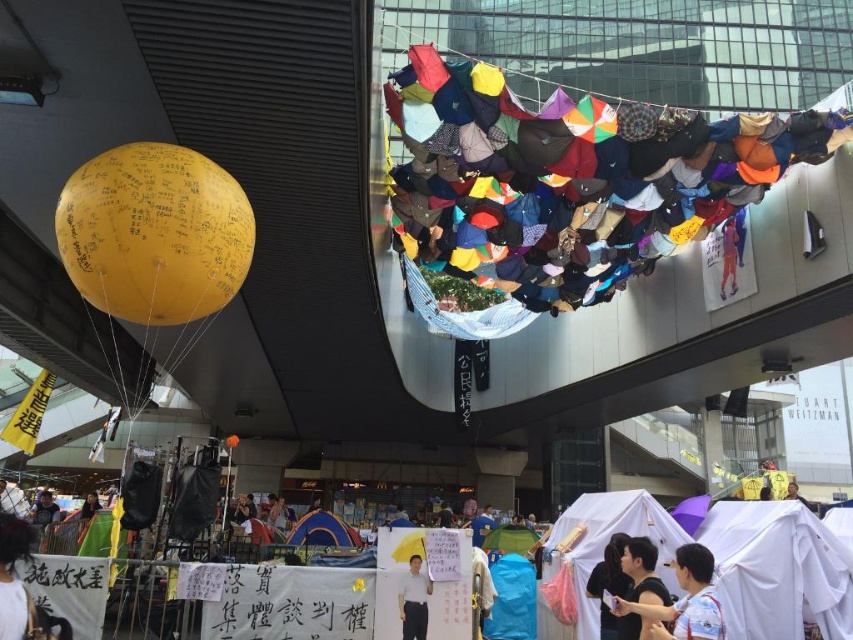
Who is more forward, (122, 266) or (96, 508)?

Point (122, 266) is more forward.

Does yellow matte balloon at left have a larger size compared to light brown fabric at lower left?

No, yellow matte balloon at left is not bigger than light brown fabric at lower left.

Does point (115, 147) come farther from viewer compared to point (83, 508)?

No, it is not.

Where is `yellow matte balloon at left`? yellow matte balloon at left is located at coordinates (154, 234).

Does orange fabric person at upper right have a lesser width compared to light brown fabric at lower left?

Yes, orange fabric person at upper right is thinner than light brown fabric at lower left.

Who is more forward, (734,244) or (100,506)?

Point (734,244) is in front.

What are the coordinates of `orange fabric person at upper right` in the screenshot? It's located at (730, 253).

Can you confirm if blue fabric tent at center is wider than dark blue shirt at lower left?

In fact, blue fabric tent at center might be narrower than dark blue shirt at lower left.

Is the position of blue fabric tent at center less distant than that of dark blue shirt at lower left?

That is True.

Is point (350, 534) in front of point (39, 509)?

Yes, it is.

Find the location of `blue fabric tent at center`. blue fabric tent at center is located at coordinates (322, 531).